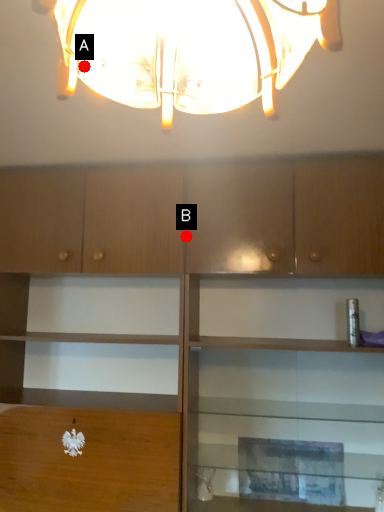
Question: Two points are circled on the image, labeled by A and B beside each circle. Which point is farther from the camera taking this photo?

Choices:
 (A) A is further
 (B) B is further

Answer: (B)